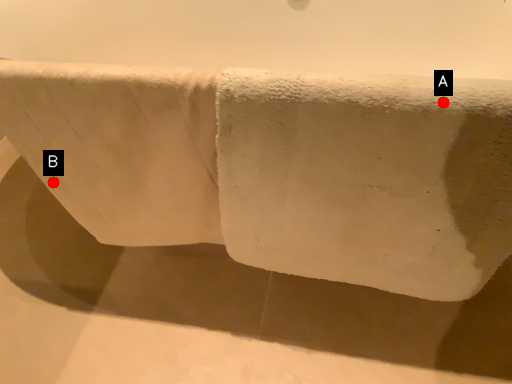
Question: Two points are circled on the image, labeled by A and B beside each circle. Which point appears closest to the camera in this image?

Choices:
 (A) A is closer
 (B) B is closer

Answer: (A)